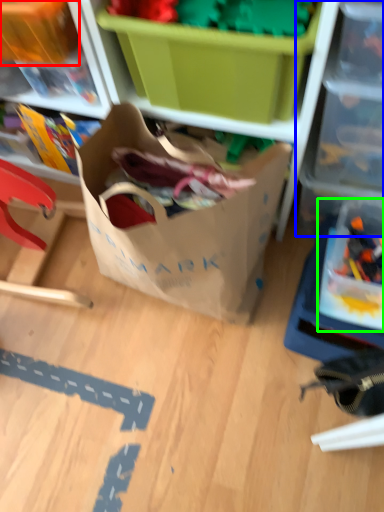
Question: Estimate the real-world distances between objects in this image. Which object is farther from storage box (highlighted by a red box), shelf (highlighted by a blue box) or storage box (highlighted by a green box)?

Choices:
 (A) shelf
 (B) storage box

Answer: (B)